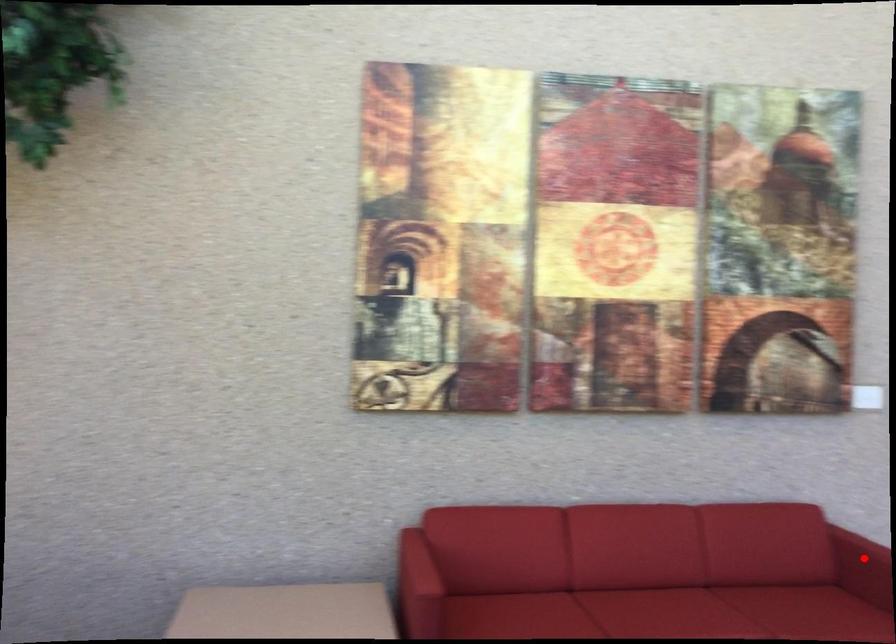
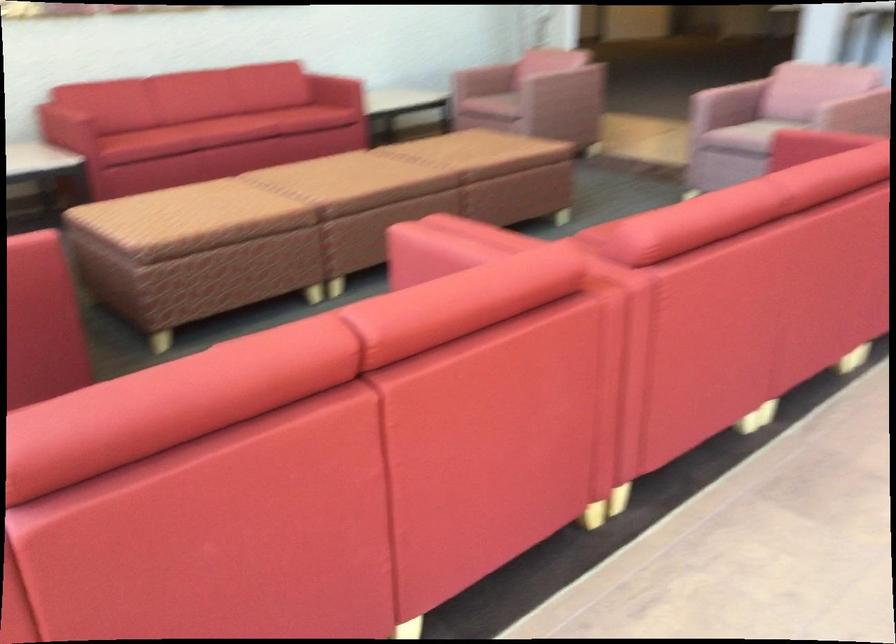
Question: I am providing you with two images of the same scene from different viewpoints. A red point is marked on the first image. Can you still see the location of the red point in image 2?

Choices:
 (A) Yes
 (B) No

Answer: (B)